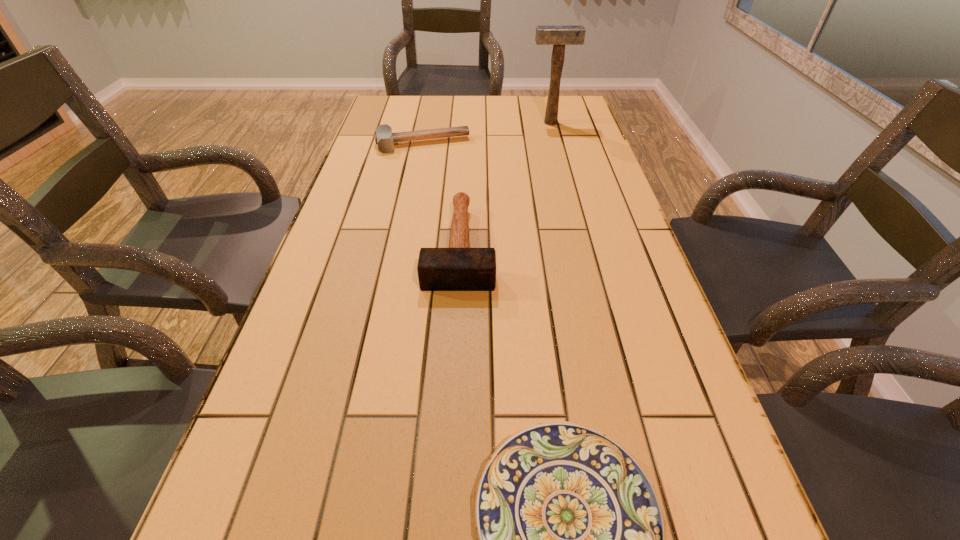
Locate an element on the screen. object located at the left edge is located at coordinates (384, 137).

Locate an element on the screen. The width and height of the screenshot is (960, 540). object at the right edge is located at coordinates [x=558, y=36].

Find the location of a particular element. Image resolution: width=960 pixels, height=540 pixels. object at the far right corner is located at coordinates (558, 36).

Image resolution: width=960 pixels, height=540 pixels. In the image, there is a desktop. Find the location of `vacant area at the left edge`. vacant area at the left edge is located at coordinates (302, 307).

This screenshot has width=960, height=540. I want to click on free spot at the right edge of the desktop, so click(x=620, y=263).

Where is `vacant space at the far right corner`? The height and width of the screenshot is (540, 960). vacant space at the far right corner is located at coordinates (574, 100).

Where is `empty location between the shortest mallet and the tallest object`? The height and width of the screenshot is (540, 960). empty location between the shortest mallet and the tallest object is located at coordinates (487, 133).

Locate an element on the screen. The width and height of the screenshot is (960, 540). free spot between the farthest mallet and the nearest mallet is located at coordinates (505, 184).

I want to click on vacant area between the second farthest object and the farthest mallet, so click(x=487, y=133).

Identify the location of vacant region between the second shortest object and the nearest mallet. (442, 194).